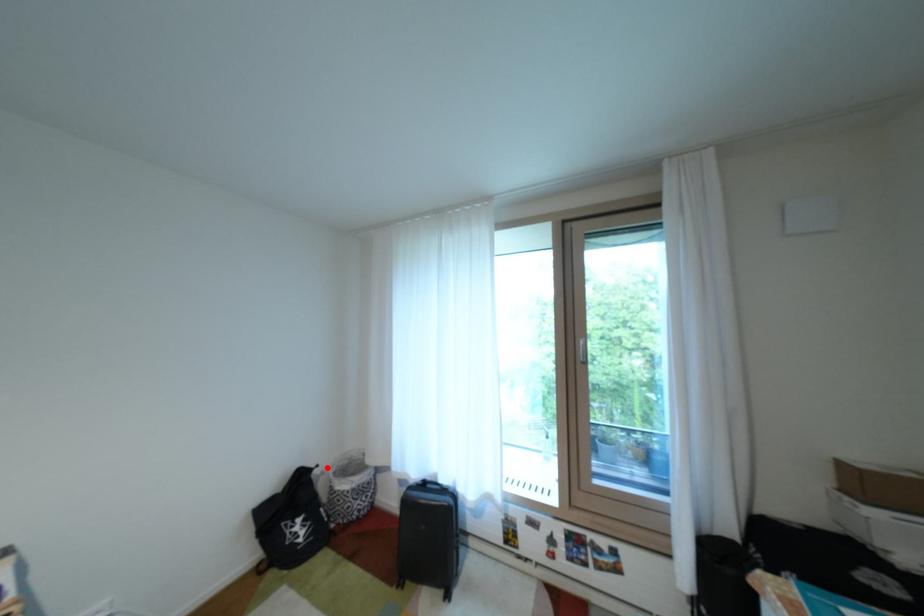
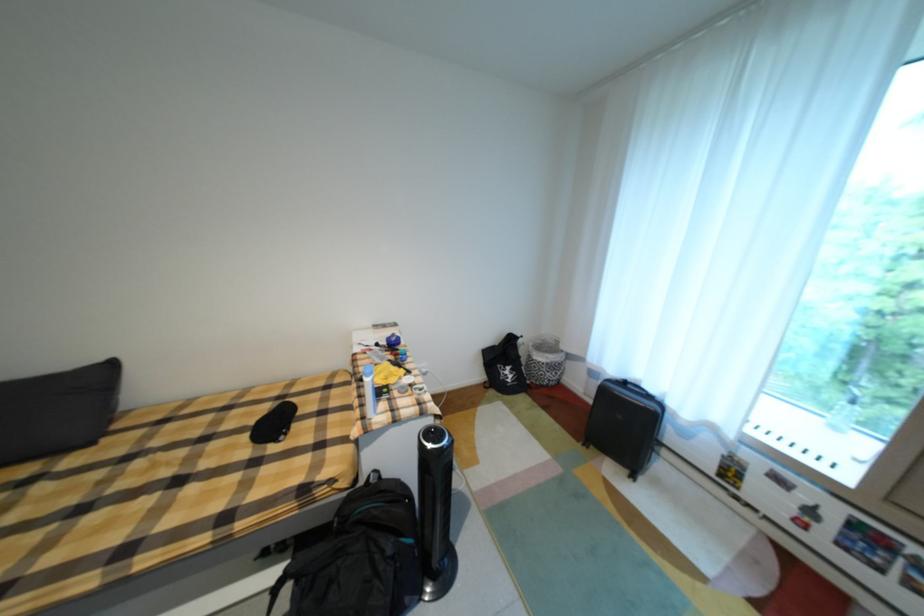
Locate, in the second image, the point that corresponds to the highlighted location in the first image.

(531, 338)